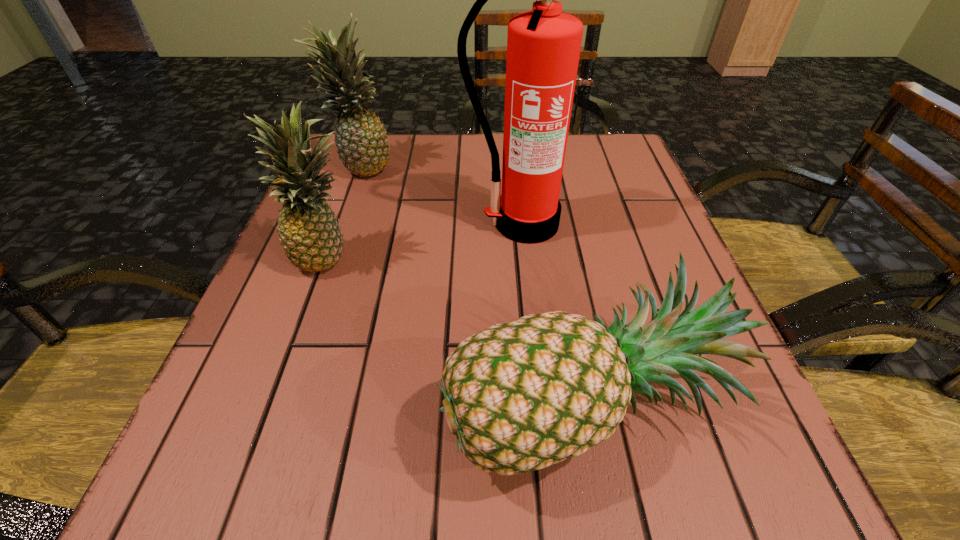
This screenshot has width=960, height=540. I want to click on free space between the fire extinguisher and the farthest pineapple, so click(x=443, y=195).

Where is `free space between the farthest pineapple and the shortest pineapple`? free space between the farthest pineapple and the shortest pineapple is located at coordinates (475, 282).

Identify the location of vacant area that lies between the tallest object and the farthest object. The width and height of the screenshot is (960, 540). (443, 195).

This screenshot has width=960, height=540. What are the coordinates of `blank region between the shortest object and the second farthest pineapple` in the screenshot? It's located at (458, 328).

Where is `free space that is in between the nearest object and the second farthest pineapple`? free space that is in between the nearest object and the second farthest pineapple is located at coordinates (458, 328).

Where is `empty location between the rightmost pineapple and the farthest pineapple`? empty location between the rightmost pineapple and the farthest pineapple is located at coordinates (475, 282).

Where is `vacant region between the fire extinguisher and the second nearest pineapple`? vacant region between the fire extinguisher and the second nearest pineapple is located at coordinates (426, 240).

Select which object is the second closest to the tallest object. Please provide its 2D coordinates. Your answer should be formatted as a tuple, i.e. [(x, y)], where the tuple contains the x and y coordinates of a point satisfying the conditions above.

[(361, 141)]

I want to click on the third closest object to the rightmost pineapple, so click(361, 141).

Where is `the second closest pineapple to the farthest object`? The width and height of the screenshot is (960, 540). the second closest pineapple to the farthest object is located at coordinates (520, 396).